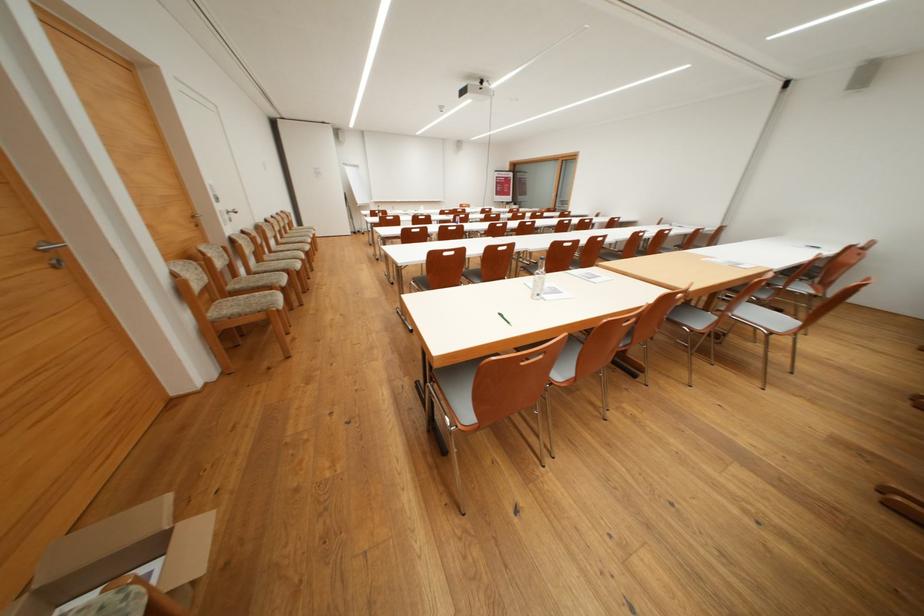
The location [120,557] corresponds to which object?

It corresponds to the open cardboard box in the image.